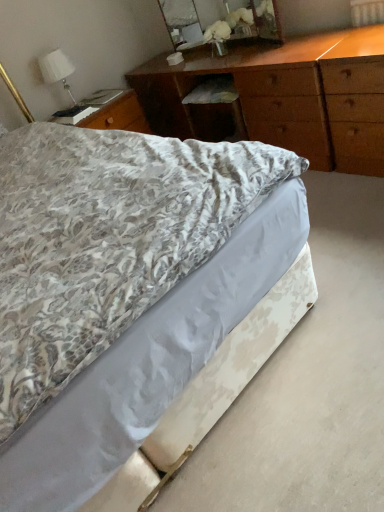
Question: From a real-world perspective, is wooden mirror at upper center beneath white fabric lampshade at upper left?

Choices:
 (A) no
 (B) yes

Answer: (B)

Question: Is wooden mirror at upper center oriented towards white fabric lampshade at upper left?

Choices:
 (A) no
 (B) yes

Answer: (B)

Question: Can you confirm if wooden mirror at upper center is taller than white fabric lampshade at upper left?

Choices:
 (A) no
 (B) yes

Answer: (B)

Question: Considering the relative positions of wooden mirror at upper center and white fabric lampshade at upper left in the image provided, is wooden mirror at upper center to the left of white fabric lampshade at upper left from the viewer's perspective?

Choices:
 (A) no
 (B) yes

Answer: (A)

Question: Does wooden mirror at upper center touch white fabric lampshade at upper left?

Choices:
 (A) no
 (B) yes

Answer: (A)

Question: Is white fabric lampshade at upper left at the back of wooden mirror at upper center?

Choices:
 (A) yes
 (B) no

Answer: (B)

Question: Is wooden chest of drawers at upper center positioned beyond the bounds of white fabric lampshade at upper left?

Choices:
 (A) yes
 (B) no

Answer: (A)

Question: Can you confirm if wooden chest of drawers at upper center is positioned to the right of white fabric lampshade at upper left?

Choices:
 (A) no
 (B) yes

Answer: (B)

Question: Does wooden chest of drawers at upper center have a greater width compared to white fabric lampshade at upper left?

Choices:
 (A) yes
 (B) no

Answer: (A)

Question: Is wooden chest of drawers at upper center thinner than white fabric lampshade at upper left?

Choices:
 (A) yes
 (B) no

Answer: (B)

Question: From the image's perspective, does wooden chest of drawers at upper center appear lower than white fabric lampshade at upper left?

Choices:
 (A) yes
 (B) no

Answer: (A)

Question: Is wooden chest of drawers at upper center behind white fabric lampshade at upper left?

Choices:
 (A) no
 (B) yes

Answer: (A)

Question: Does white fabric lampshade at upper left have a greater height compared to floral-patterned fabric bed at center?

Choices:
 (A) yes
 (B) no

Answer: (A)